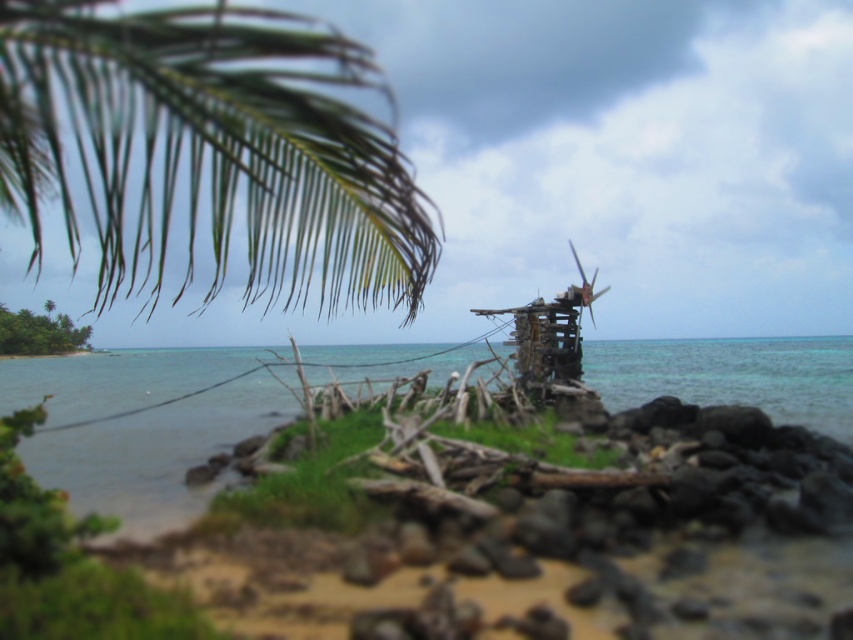
You are a photographer standing at the shoreline. You want to capture a photo that includes both the green leafy palm at upper left and the clear blue water at center. Which object should you focus on first to ensure both are in sharp focus?

You should focus on the green leafy palm at upper left first because it is closer to the viewer than the clear blue water at center. By focusing on the closer object, the farther object will still be within the depth of field and appear sharp in the photo.

You are a drone operator trying to capture a photo of the clear blue water at center. The green leafy palm at upper left might block your shot. Can you estimate if the palm is far enough away from the water to avoid blocking the view?

The green leafy palm at upper left is 25.77 meters away from clear blue water at center, so it is far enough away to avoid blocking the view.

You are a photographer trying to capture the clear blue water at center in your shot. You notice the green leafy palm at upper left might block part of the water. Based on their sizes, will the palm block the water?

The green leafy palm at upper left is thinner than the clear blue water at center, so it is unlikely to block the water as it is narrower in width.